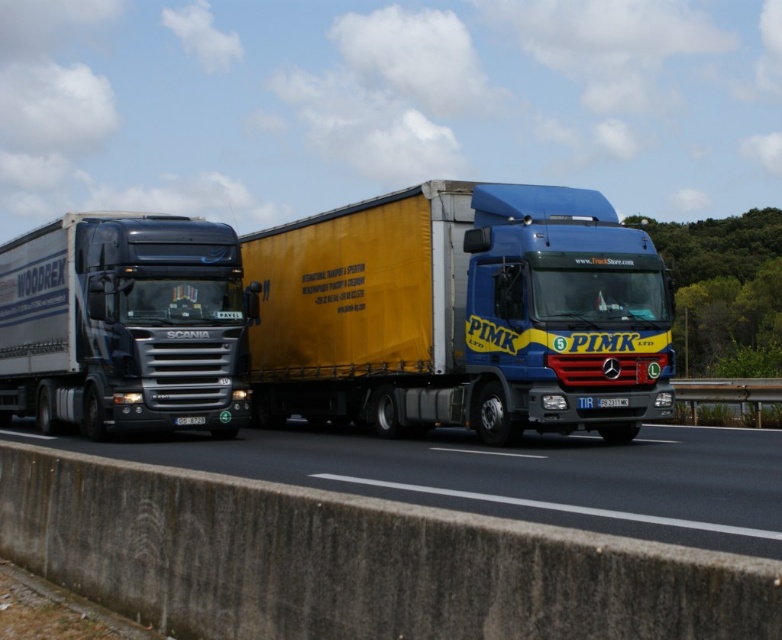
You are a drone operator trying to capture a photo of the metallic silver truck at left from above. The drone has a maximum safe flying distance of 15 meters. Can the drone safely fly to the truck to take the photo?

The distance between the metallic silver truck at left and the camera is 15.89 meters, which exceeds the drone operator maximum safe flying distance of 15 meters. Therefore, the drone cannot safely fly to the truck to take the photo.

You are a delivery driver who needs to overtake the metallic silver truck at left while driving the yellow matte trailer truck at center. Given that your truck requires a minimum of 15 feet to safely overtake, can you safely perform this maneuver?

The yellow matte trailer truck at center is 14.80 feet away from the metallic silver truck at left. Since the required minimum distance for safe overtaking is 15 feet, the distance is insufficient, so you cannot safely overtake the metallic silver truck at left with the current gap.